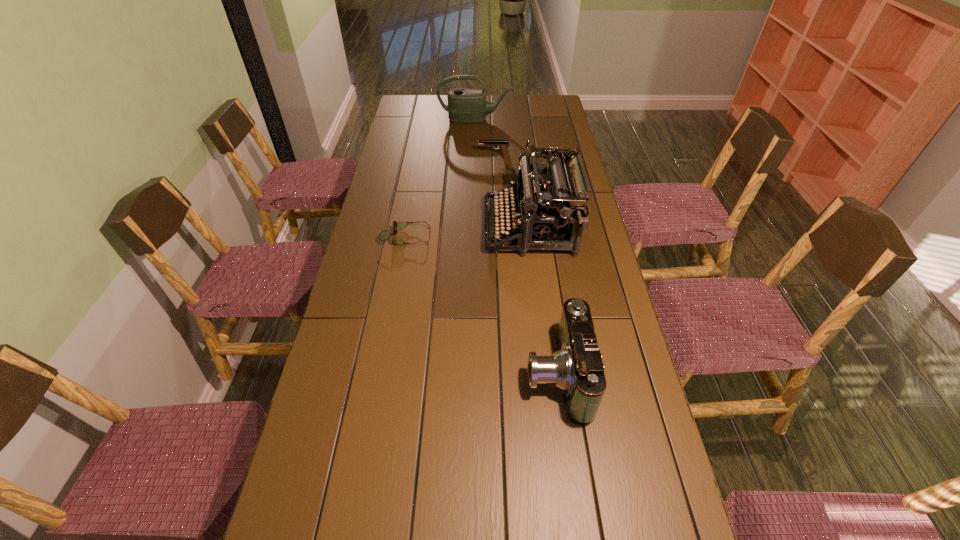
At what (x,y) coordinates should I click in order to perform the action: click on vacant space located 0.370m on the typing side of the typewriter. Please return your answer as a coordinate pair (x, y). Looking at the image, I should click on (384, 227).

Find the location of a particular element. free space located on the spout of the farthest object is located at coordinates (474, 153).

At what (x,y) coordinates should I click in order to perform the action: click on free space located 0.390m on the front-facing side of the third shortest object. Please return your answer as a coordinate pair (x, y). Looking at the image, I should click on (381, 375).

This screenshot has width=960, height=540. What are the coordinates of `vacant space located 0.140m on the front-facing side of the third shortest object` in the screenshot? It's located at (473, 375).

At what (x,y) coordinates should I click in order to perform the action: click on free location located on the front-facing side of the third shortest object. Please return your answer as a coordinate pair (x, y). The image size is (960, 540). Looking at the image, I should click on (429, 375).

Where is `vacant space located at the muzzle of the second shortest object`? vacant space located at the muzzle of the second shortest object is located at coordinates (443, 157).

I want to click on vacant space located 0.180m at the muzzle of the second shortest object, so click(438, 157).

Locate an element on the screen. vacant space located at the muzzle of the second shortest object is located at coordinates (407, 157).

The height and width of the screenshot is (540, 960). What are the coordinates of `free location located on the front-facing side of the spectacles` in the screenshot? It's located at (480, 238).

Locate an element on the screen. object located at the far edge is located at coordinates (464, 105).